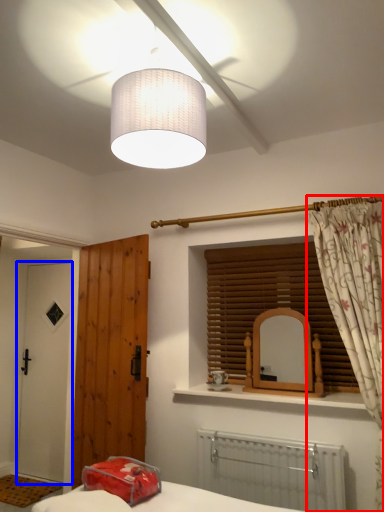
Question: Which of the following is the farthest to the observer, curtain (highlighted by a red box) or door (highlighted by a blue box)?

Choices:
 (A) curtain
 (B) door

Answer: (B)